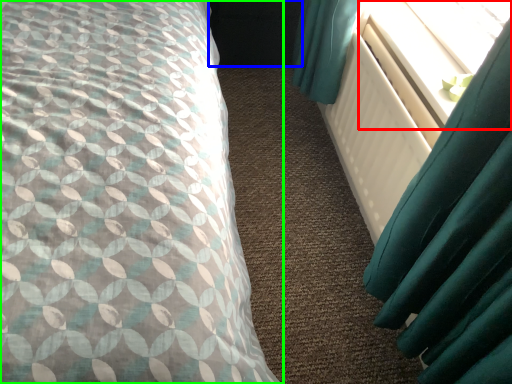
Question: Considering the real-world distances, which object is farthest from window screen (highlighted by a red box)? dark (highlighted by a blue box) or bed (highlighted by a green box)?

Choices:
 (A) dark
 (B) bed

Answer: (A)